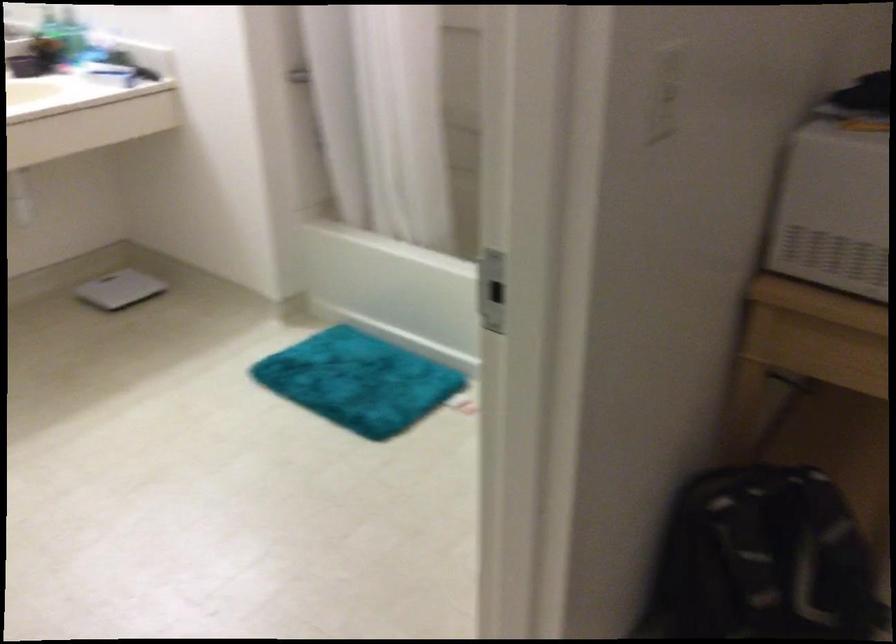
Find the location of `white bathroom scale`. white bathroom scale is located at coordinates (119, 289).